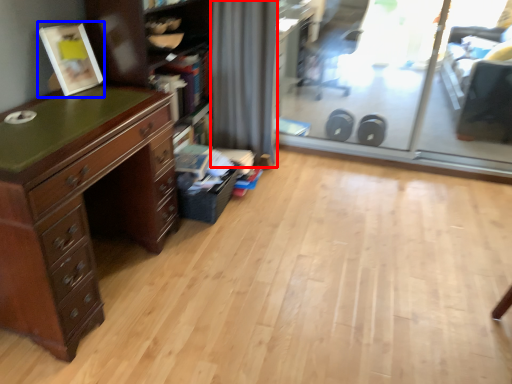
Question: Among these objects, which one is farthest to the camera, curtain (highlighted by a red box) or picture frame (highlighted by a blue box)?

Choices:
 (A) curtain
 (B) picture frame

Answer: (A)